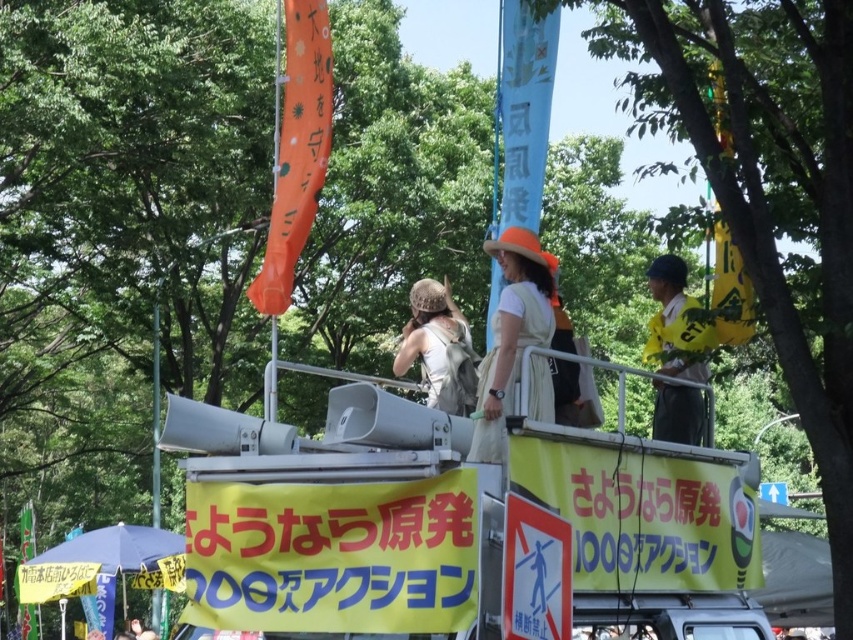
You are standing in front of the platform with the yellow banners. There are two points marked on the platform. One is at coordinate point (97, 529) and the other is at point (157, 486). Which point is closer to you?

Point (97, 529) is closer to the camera than point (157, 486), so the point at (97, 529) is closer to you.

You are at the protest and want to take a photo of both the beige fabric hat at center and the yellow fabric shirt at right. Which object should you frame first in your camera viewfinder to ensure both are in the shot?

You should frame the beige fabric hat at center first since it is to the left of the yellow fabric shirt at right, ensuring both are included in the photo.